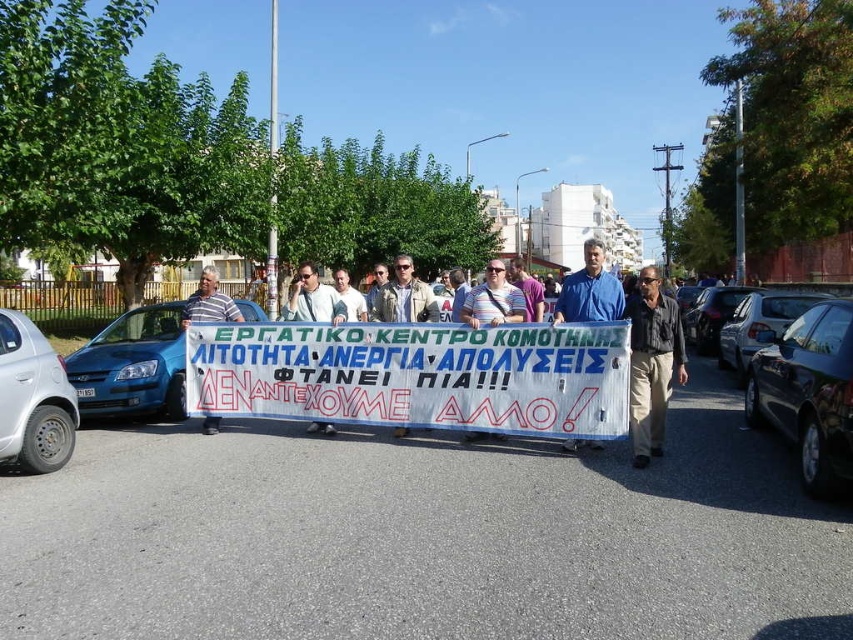
Question: Which point appears farthest from the camera in this image?

Choices:
 (A) (657, 435)
 (B) (416, 282)
 (C) (827, 340)

Answer: (B)

Question: Is dark gray shirt at center smaller than white plastic sign at center?

Choices:
 (A) no
 (B) yes

Answer: (A)

Question: Which of these objects is positioned farthest from the dark gray shirt at center?

Choices:
 (A) blue metallic car at left
 (B) white paper banner at center
 (C) light brown leather jacket at center
 (D) shiny black car at right

Answer: (A)

Question: Is dark gray shirt at center wider than black glossy sedan at center?

Choices:
 (A) no
 (B) yes

Answer: (B)

Question: Which object is closer to the camera taking this photo?

Choices:
 (A) white paper banner at center
 (B) black glossy car at right
 (C) matte white banner at center

Answer: (B)

Question: Does matte white banner at center appear on the right side of black glossy sedan at center?

Choices:
 (A) no
 (B) yes

Answer: (A)